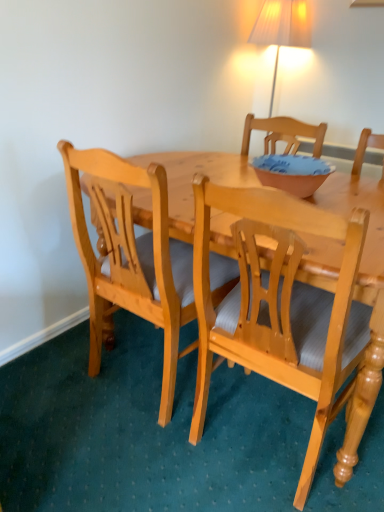
Question: Is light wood chair at center, positioned as the 1th chair in right-to-left order, far away from matte pink bowl at center?

Choices:
 (A) yes
 (B) no

Answer: (B)

Question: From a real-world perspective, is light wood chair at center, the second chair positioned from the left, on matte pink bowl at center?

Choices:
 (A) yes
 (B) no

Answer: (B)

Question: Can you confirm if light wood chair at center, the second chair positioned from the left, is thinner than matte pink bowl at center?

Choices:
 (A) no
 (B) yes

Answer: (A)

Question: Is the position of light wood chair at center, the second chair positioned from the left, less distant than that of matte pink bowl at center?

Choices:
 (A) no
 (B) yes

Answer: (B)

Question: From a real-world perspective, is light wood chair at center, positioned as the 1th chair in right-to-left order, physically below matte pink bowl at center?

Choices:
 (A) yes
 (B) no

Answer: (A)

Question: Looking at their shapes, would you say matte pink bowl at center is wider or thinner than light wood chair at center, positioned as the 1th chair in right-to-left order?

Choices:
 (A) wide
 (B) thin

Answer: (B)

Question: From a real-world perspective, is matte pink bowl at center above or below light wood chair at center, positioned as the 1th chair in right-to-left order?

Choices:
 (A) above
 (B) below

Answer: (A)

Question: Visually, is matte pink bowl at center positioned to the left or to the right of light wood chair at center, the second chair positioned from the left?

Choices:
 (A) right
 (B) left

Answer: (A)

Question: In terms of height, does matte pink bowl at center look taller or shorter compared to light wood chair at center, positioned as the 1th chair in right-to-left order?

Choices:
 (A) tall
 (B) short

Answer: (B)

Question: Based on their sizes in the image, would you say light wood chair at center, the second chair viewed from the right, is bigger or smaller than light wood chair at center, positioned as the 1th chair in right-to-left order?

Choices:
 (A) big
 (B) small

Answer: (B)

Question: From the image's perspective, is light wood chair at center, the first chair positioned from the left, positioned above or below light wood chair at center, the second chair positioned from the left?

Choices:
 (A) above
 (B) below

Answer: (A)

Question: Which is correct: light wood chair at center, the first chair positioned from the left, is inside light wood chair at center, the second chair positioned from the left, or outside of it?

Choices:
 (A) outside
 (B) inside

Answer: (A)

Question: Considering the positions of light wood chair at center, the second chair viewed from the right, and light wood chair at center, positioned as the 1th chair in right-to-left order, in the image, is light wood chair at center, the second chair viewed from the right, wider or thinner than light wood chair at center, positioned as the 1th chair in right-to-left order,?

Choices:
 (A) thin
 (B) wide

Answer: (A)

Question: Is matte pink bowl at center wider or thinner than light wood chair at center, the first chair positioned from the left?

Choices:
 (A) thin
 (B) wide

Answer: (A)

Question: From the image's perspective, is matte pink bowl at center above or below light wood chair at center, the first chair positioned from the left?

Choices:
 (A) below
 (B) above

Answer: (B)